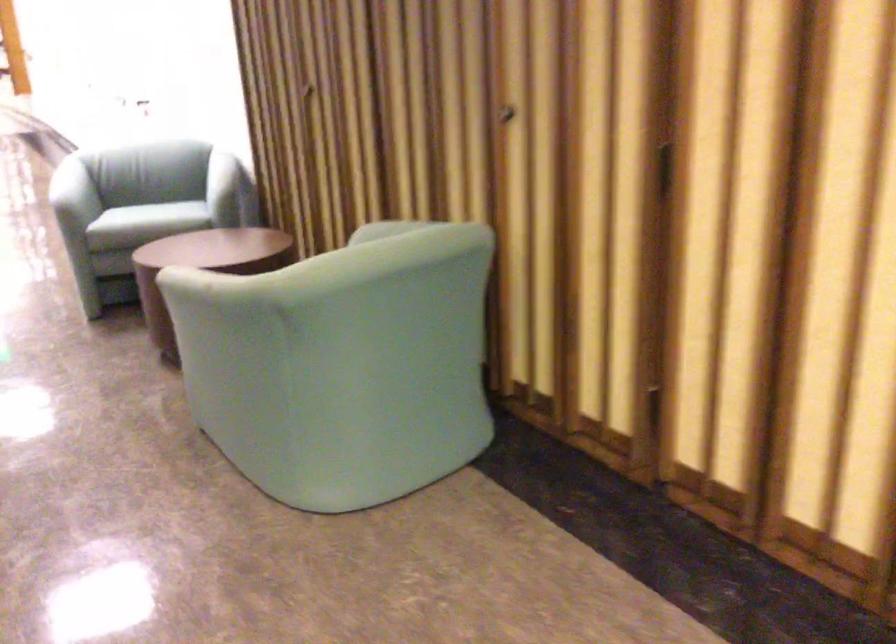
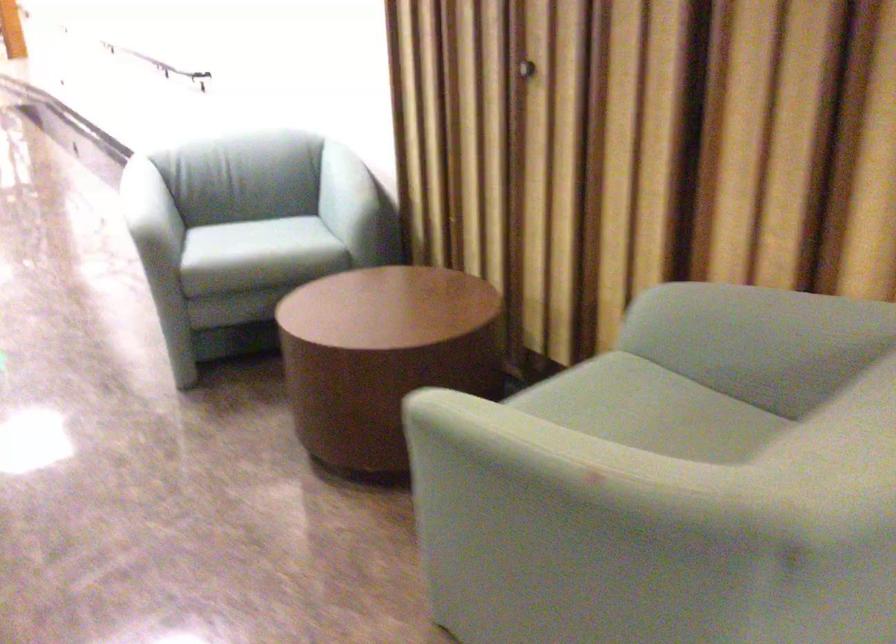
Question: I am providing you with two images of the same scene from different viewpoints. Please identify which objects are invisible in image2.

Choices:
 (A) chair armrest
 (B) round door handle
 (C) chair sitting surface
 (D) none of these

Answer: (D)